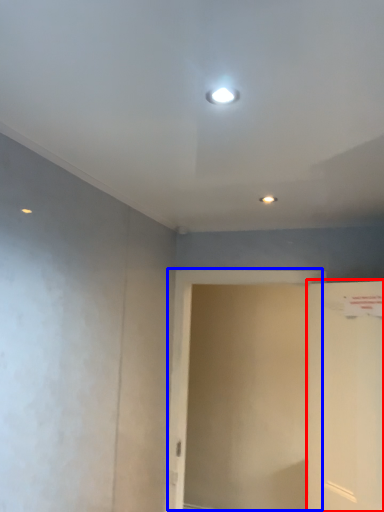
Question: Which object is further to the camera taking this photo, door (highlighted by a red box) or screen door (highlighted by a blue box)?

Choices:
 (A) door
 (B) screen door

Answer: (B)